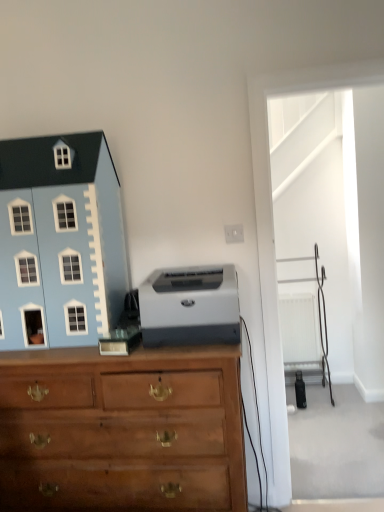
Question: Is wooden chest of drawers at center bigger than light blue plastic toy house at left?

Choices:
 (A) yes
 (B) no

Answer: (A)

Question: Is wooden chest of drawers at center further to the viewer compared to light blue plastic toy house at left?

Choices:
 (A) yes
 (B) no

Answer: (B)

Question: Can you confirm if wooden chest of drawers at center is shorter than light blue plastic toy house at left?

Choices:
 (A) yes
 (B) no

Answer: (B)

Question: Can you confirm if wooden chest of drawers at center is positioned to the left of light blue plastic toy house at left?

Choices:
 (A) yes
 (B) no

Answer: (B)

Question: Is wooden chest of drawers at center not near light blue plastic toy house at left?

Choices:
 (A) no
 (B) yes

Answer: (A)

Question: From the image's perspective, is light blue plastic toy house at left positioned above or below white plastic radiator at right?

Choices:
 (A) below
 (B) above

Answer: (B)

Question: Does point click(44, 324) appear closer or farther from the camera than point click(294, 303)?

Choices:
 (A) farther
 (B) closer

Answer: (B)

Question: Visually, is light blue plastic toy house at left positioned to the left or to the right of white plastic radiator at right?

Choices:
 (A) right
 (B) left

Answer: (B)

Question: Considering their positions, is light blue plastic toy house at left located in front of or behind white plastic radiator at right?

Choices:
 (A) front
 (B) behind

Answer: (A)

Question: Relative to wooden chest of drawers at center, is gray matte printer at center in front or behind?

Choices:
 (A) front
 (B) behind

Answer: (B)

Question: Considering the positions of gray matte printer at center and wooden chest of drawers at center in the image, is gray matte printer at center wider or thinner than wooden chest of drawers at center?

Choices:
 (A) wide
 (B) thin

Answer: (B)

Question: From a real-world perspective, is gray matte printer at center positioned above or below wooden chest of drawers at center?

Choices:
 (A) above
 (B) below

Answer: (A)

Question: Visually, is gray matte printer at center positioned to the left or to the right of wooden chest of drawers at center?

Choices:
 (A) left
 (B) right

Answer: (B)

Question: From the image's perspective, relative to wooden chest of drawers at center, is white plastic radiator at right above or below?

Choices:
 (A) below
 (B) above

Answer: (B)

Question: Relative to wooden chest of drawers at center, is white plastic radiator at right in front or behind?

Choices:
 (A) front
 (B) behind

Answer: (B)